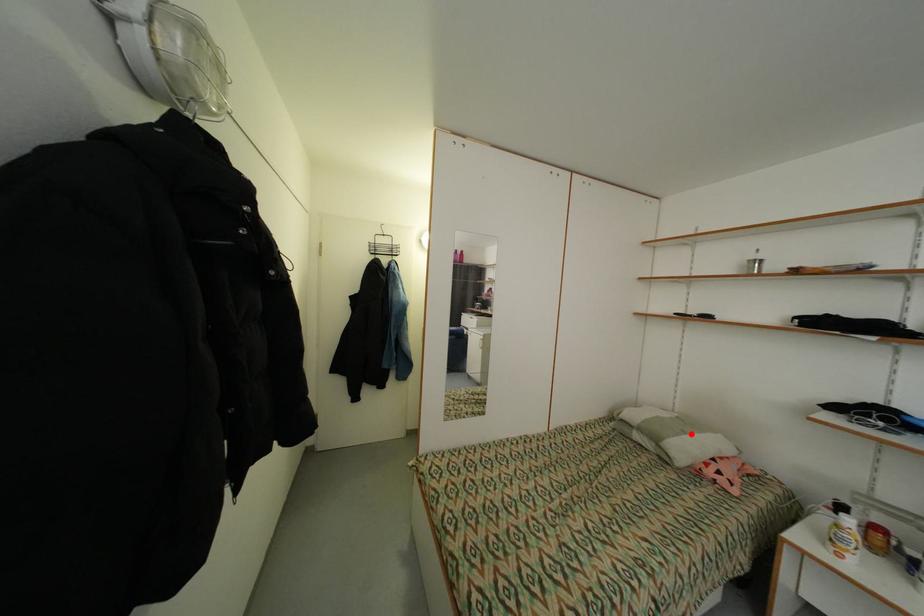
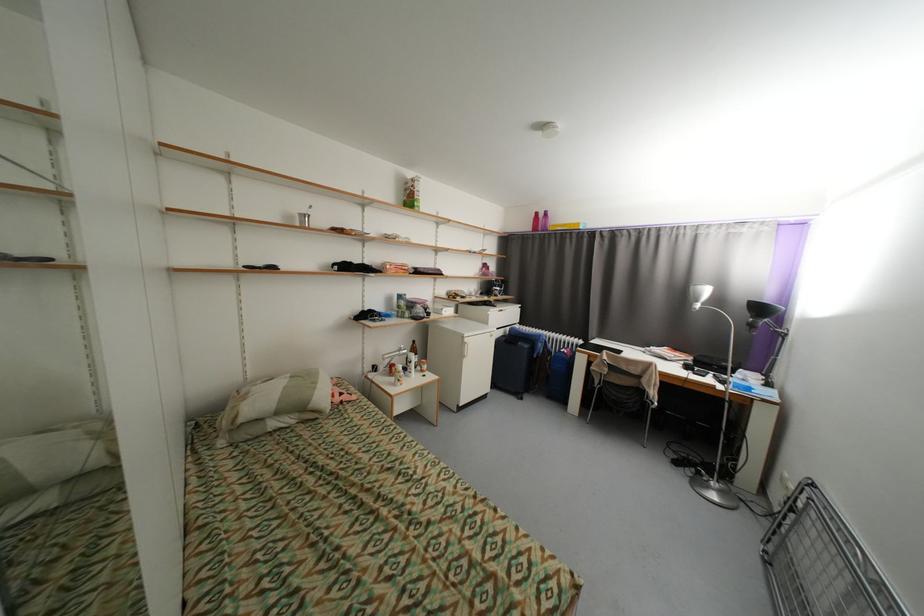
In the second image, find the point that corresponds to the highlighted location in the first image.

(322, 384)